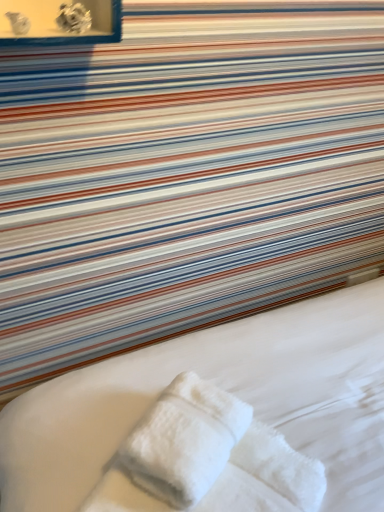
Find the location of a particular element. The width and height of the screenshot is (384, 512). white fluffy towel at center is located at coordinates (184, 440).

In order to face white fluffy towel at center, should I rotate leftwards or rightwards?

Rotate your view left by about 0.555°.

Describe the element at coordinates (184, 440) in the screenshot. I see `white fluffy towel at center` at that location.

Locate an element on the screen. white fluffy towel at center is located at coordinates (184, 440).